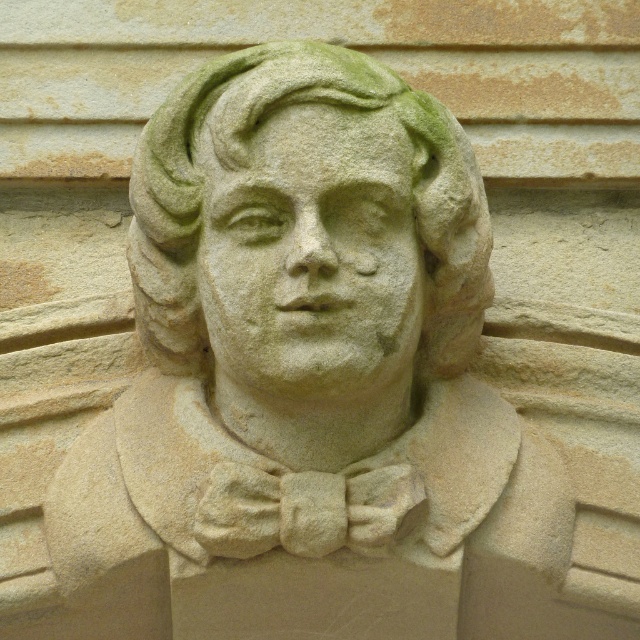
Question: Which object is closer to the camera taking this photo?

Choices:
 (A) green stone bust at center
 (B) green stone face at center

Answer: (B)

Question: Is green stone face at center further to camera compared to green stone bust at center?

Choices:
 (A) yes
 (B) no

Answer: (B)

Question: Among these points, which one is farthest from the camera?

Choices:
 (A) (292, 92)
 (B) (284, 125)

Answer: (B)

Question: Which object appears closest to the camera in this image?

Choices:
 (A) green stone bust at center
 (B) green stone face at center

Answer: (B)

Question: Does green stone face at center appear under green stone bust at center?

Choices:
 (A) no
 (B) yes

Answer: (B)

Question: Can you confirm if green stone face at center is positioned to the right of green stone bust at center?

Choices:
 (A) yes
 (B) no

Answer: (A)